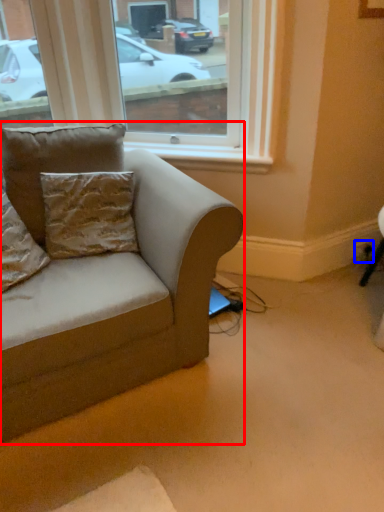
Question: Which of the following is the closest to the observer, studio couch (highlighted by a red box) or electric outlet (highlighted by a blue box)?

Choices:
 (A) studio couch
 (B) electric outlet

Answer: (A)